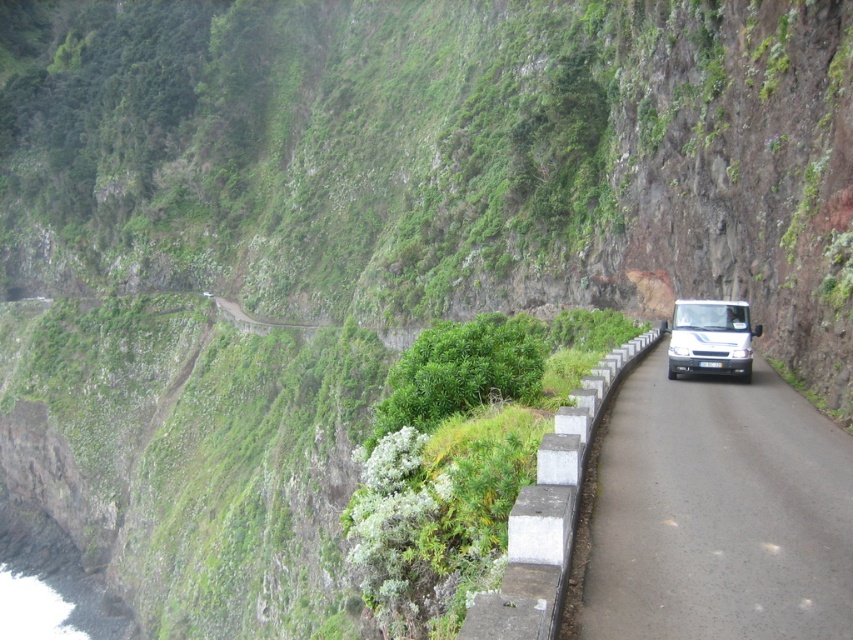
Question: Can you confirm if black asphalt road at right is positioned above white matte van at center?

Choices:
 (A) no
 (B) yes

Answer: (A)

Question: Does black asphalt road at right have a larger size compared to white matte van at center?

Choices:
 (A) yes
 (B) no

Answer: (A)

Question: Which point is farther to the camera?

Choices:
 (A) white matte van at center
 (B) black asphalt road at right

Answer: (A)

Question: Can you confirm if black asphalt road at right is smaller than white matte van at center?

Choices:
 (A) yes
 (B) no

Answer: (B)

Question: Which object is closer to the camera taking this photo?

Choices:
 (A) black asphalt road at right
 (B) white matte van at center

Answer: (A)

Question: Among these objects, which one is farthest from the camera?

Choices:
 (A) white matte van at center
 (B) black asphalt road at right

Answer: (A)